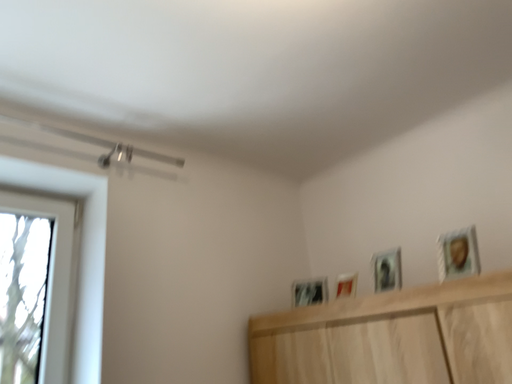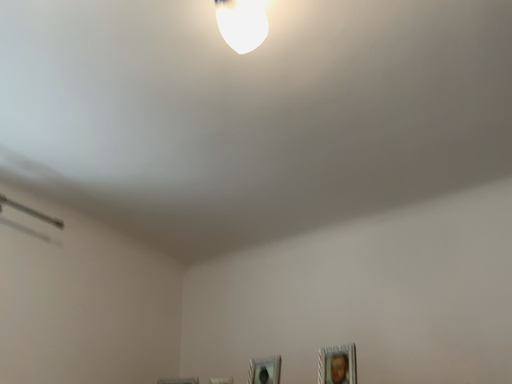
Question: How did the camera likely rotate when shooting the video?

Choices:
 (A) rotated downward
 (B) rotated upward

Answer: (B)